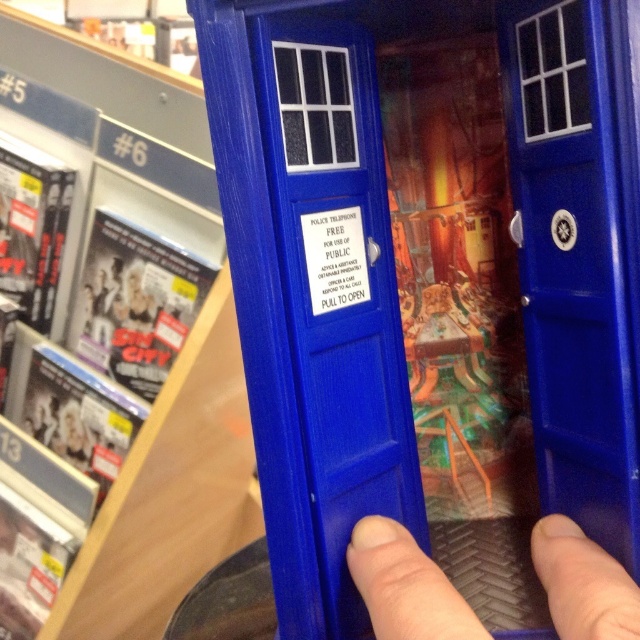
Does blue plastic bookshelf at center have a greater width compared to blue plastic finger at lower center?

Yes.

Based on the photo, can you confirm if blue plastic bookshelf at center is shorter than blue plastic finger at lower center?

Incorrect, blue plastic bookshelf at center's height does not fall short of blue plastic finger at lower center's.

Who is more distant from viewer, (x=12, y=92) or (x=554, y=596)?

Point (x=12, y=92)

The width and height of the screenshot is (640, 640). What are the coordinates of `blue plastic bookshelf at center` in the screenshot? It's located at (179, 340).